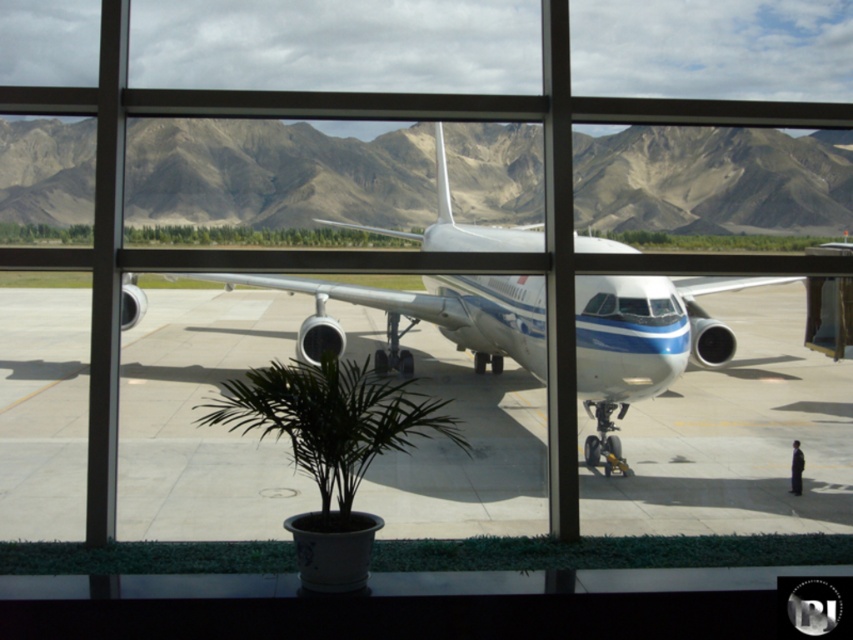
Question: Is gray concrete tarmac at center smaller than white glossy airplane at center?

Choices:
 (A) no
 (B) yes

Answer: (B)

Question: Does gray concrete tarmac at center lie in front of white glossy airplane at center?

Choices:
 (A) no
 (B) yes

Answer: (A)

Question: Which object is closer to the camera taking this photo?

Choices:
 (A) gray concrete tarmac at center
 (B) white glossy airplane at center

Answer: (B)

Question: Is the position of gray concrete tarmac at center less distant than that of white glossy airplane at center?

Choices:
 (A) no
 (B) yes

Answer: (A)